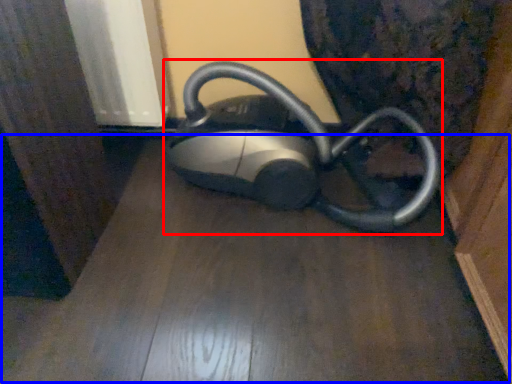
Question: Which object appears closest to the camera in this image, home appliance (highlighted by a red box) or surface (highlighted by a blue box)?

Choices:
 (A) home appliance
 (B) surface

Answer: (B)